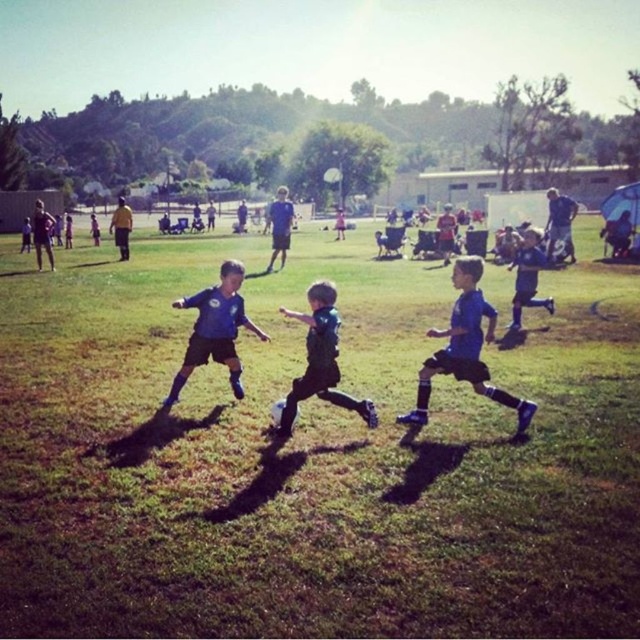
Is blue matte soccer player at center taller than blue jersey at center?

Indeed, blue matte soccer player at center has a greater height compared to blue jersey at center.

From the picture: Which of these two, blue matte soccer player at center or blue jersey at center, stands taller?

With more height is blue matte soccer player at center.

Between point (460, 282) and point (224, 268), which one is positioned behind?

Point (224, 268)

Identify the location of blue matte soccer player at center. Image resolution: width=640 pixels, height=640 pixels. (465, 348).

Between blue matte soccer player at center and dark blue jersey at center, which one appears on the left side from the viewer's perspective?

dark blue jersey at center is more to the left.

Is blue matte soccer player at center positioned in front of dark blue jersey at center?

No, it is not.

Locate an element on the screen. blue matte soccer player at center is located at coordinates [465, 348].

The width and height of the screenshot is (640, 640). Identify the location of blue matte soccer player at center. (465, 348).

Is dark blue jersey at center further to camera compared to blue matte soccer jersey at right?

No, it is in front of blue matte soccer jersey at right.

Is dark blue jersey at center positioned before blue matte soccer jersey at right?

Yes, it is in front of blue matte soccer jersey at right.

Where is `dark blue jersey at center`? The height and width of the screenshot is (640, 640). dark blue jersey at center is located at coordinates (321, 358).

Locate an element on the screen. Image resolution: width=640 pixels, height=640 pixels. dark blue jersey at center is located at coordinates (321, 358).